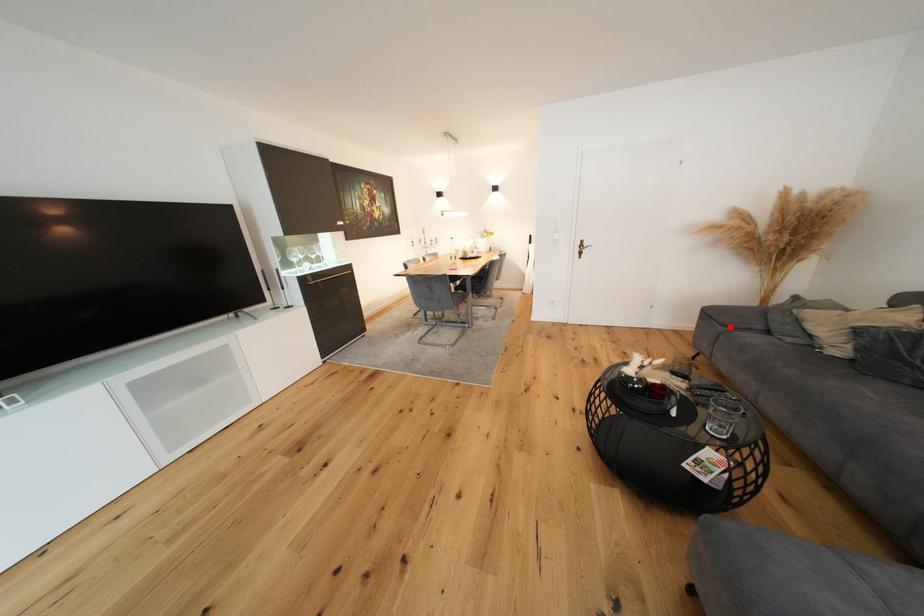
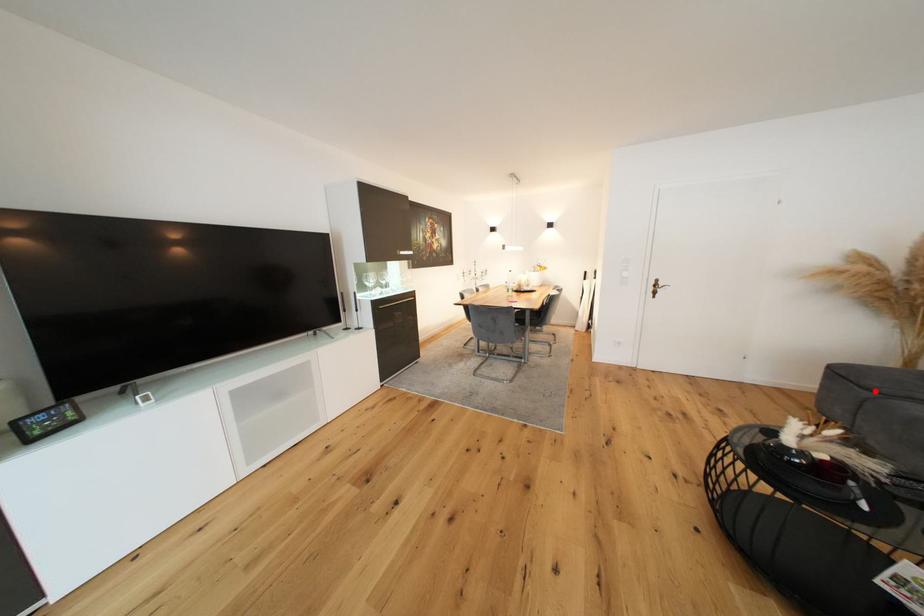
I am providing you with two images of the same scene from different viewpoints. A red point is marked on the first image and another point is marked on the second image. Do the highlighted points in image1 and image2 indicate the same real-world spot?

Yes